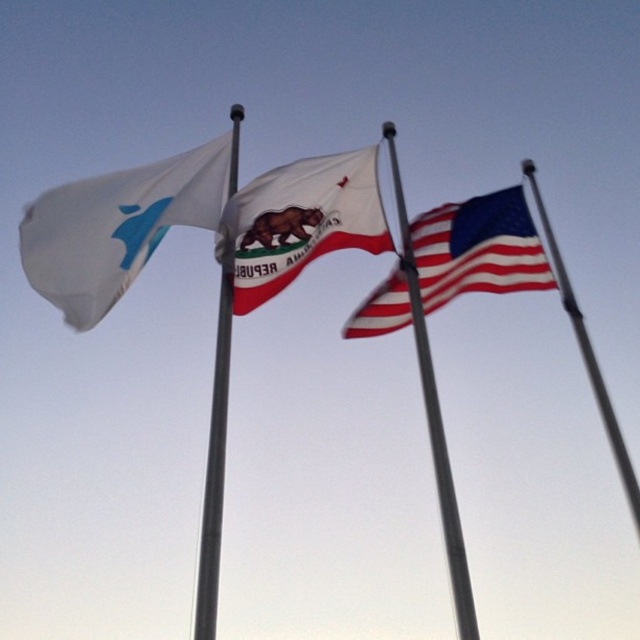
Question: Among these objects, which one is farthest from the camera?

Choices:
 (A) silver metallic flag pole at center
 (B) metallic silver flagpole at upper right

Answer: (B)

Question: From the image, what is the correct spatial relationship of white cotton flag at center in relation to american flag at center?

Choices:
 (A) left
 (B) right

Answer: (A)

Question: In this image, where is silver metallic flag pole at center located relative to metallic silver flagpole at upper right?

Choices:
 (A) right
 (B) left

Answer: (B)

Question: Based on their relative distances, which object is farther from the white fabric flag at left?

Choices:
 (A) metallic silver flagpole at upper right
 (B) white cotton flag at center

Answer: (A)

Question: Which point is farther to the camera?

Choices:
 (A) (204, 588)
 (B) (596, 378)
 (C) (268, 172)
 (D) (440, 508)

Answer: (D)

Question: Can you confirm if white cotton flag at center is positioned below silver metallic flag pole at center?

Choices:
 (A) no
 (B) yes

Answer: (A)